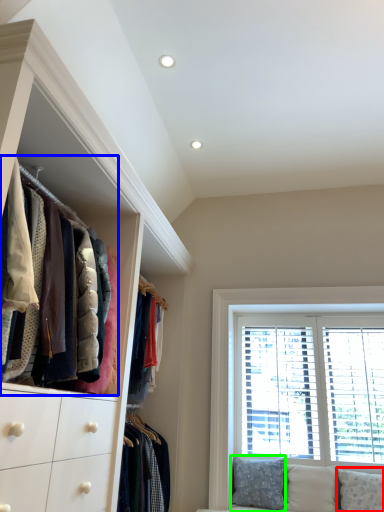
Question: Which object is the closest to the pillow (highlighted by a red box)? Choose among these: closet (highlighted by a blue box) or pillow (highlighted by a green box).

Choices:
 (A) closet
 (B) pillow

Answer: (B)